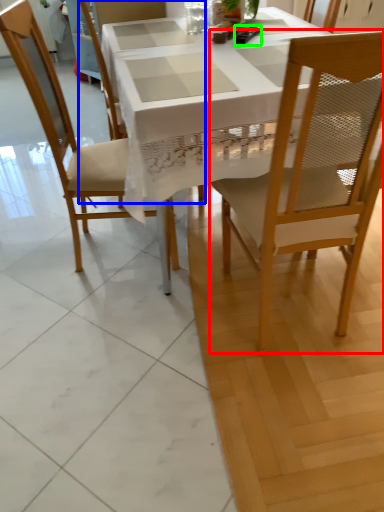
Question: Estimate the real-world distances between objects in this image. Which object is farther from chair (highlighted by a red box), chair (highlighted by a blue box) or remote control (highlighted by a green box)?

Choices:
 (A) chair
 (B) remote control

Answer: (A)